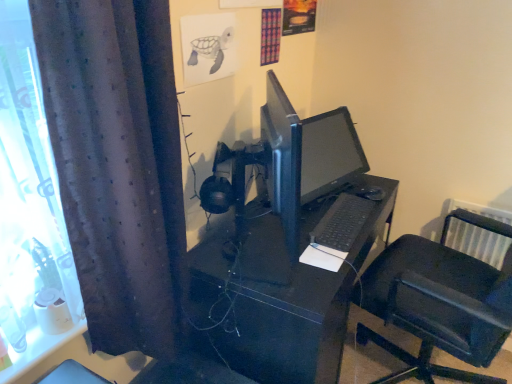
Question: Should I look upward or downward to see black matte desk at center?

Choices:
 (A) up
 (B) down

Answer: (B)

Question: From the image's perspective, would you say dark purple fabric curtain at left is shown under black plastic chair at right?

Choices:
 (A) yes
 (B) no

Answer: (B)

Question: Does dark purple fabric curtain at left contain black plastic chair at right?

Choices:
 (A) no
 (B) yes

Answer: (A)

Question: Can you confirm if dark purple fabric curtain at left is thinner than black plastic chair at right?

Choices:
 (A) yes
 (B) no

Answer: (A)

Question: Is dark purple fabric curtain at left aimed at black plastic chair at right?

Choices:
 (A) yes
 (B) no

Answer: (B)

Question: Is black plastic chair at right at the back of dark purple fabric curtain at left?

Choices:
 (A) yes
 (B) no

Answer: (B)

Question: Are dark purple fabric curtain at left and black plastic chair at right far apart?

Choices:
 (A) yes
 (B) no

Answer: (B)

Question: Is black plastic chair at right taller than black matte keyboard at center?

Choices:
 (A) yes
 (B) no

Answer: (A)

Question: Is black plastic chair at right outside black matte keyboard at center?

Choices:
 (A) yes
 (B) no

Answer: (A)

Question: Does black plastic chair at right have a smaller size compared to black matte keyboard at center?

Choices:
 (A) yes
 (B) no

Answer: (B)

Question: Is black plastic chair at right facing towards black matte keyboard at center?

Choices:
 (A) yes
 (B) no

Answer: (A)

Question: Considering the relative positions of black plastic chair at right and black matte keyboard at center in the image provided, is black plastic chair at right behind black matte keyboard at center?

Choices:
 (A) yes
 (B) no

Answer: (B)

Question: Is black plastic chair at right in front of black matte keyboard at center?

Choices:
 (A) no
 (B) yes

Answer: (B)

Question: Considering the relative positions of black glossy monitor at center and black matte keyboard at center in the image provided, is black glossy monitor at center to the right of black matte keyboard at center from the viewer's perspective?

Choices:
 (A) no
 (B) yes

Answer: (A)